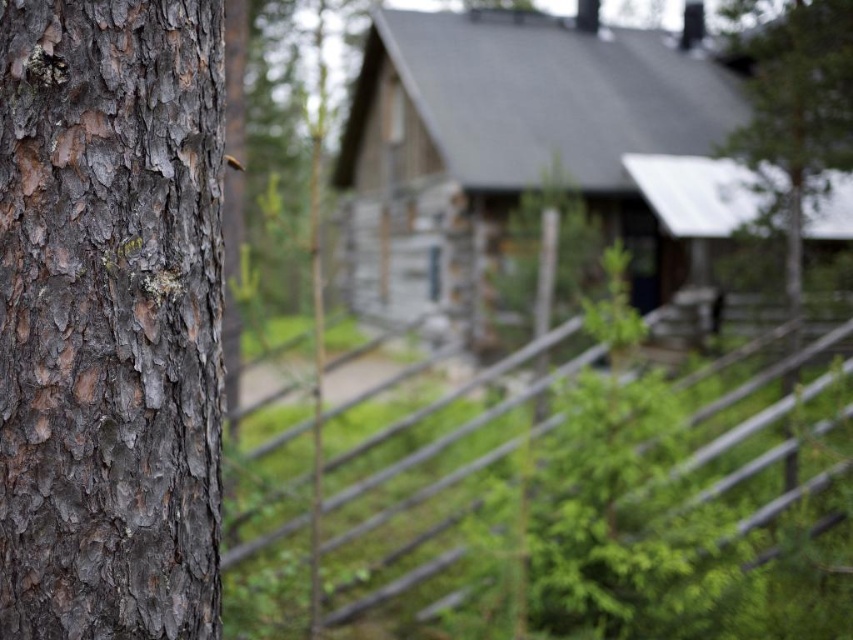
Question: Is wooden cabin at center to the right of wooden at center from the viewer's perspective?

Choices:
 (A) yes
 (B) no

Answer: (B)

Question: Where is wooden cabin at center located in relation to wooden at center in the image?

Choices:
 (A) below
 (B) above

Answer: (B)

Question: Does wooden cabin at center appear on the right side of green rough bark tree at upper right?

Choices:
 (A) no
 (B) yes

Answer: (A)

Question: Which point is closer to the camera?

Choices:
 (A) (334, 547)
 (B) (440, 282)
 (C) (844, 92)

Answer: (A)

Question: Which point is closer to the camera taking this photo?

Choices:
 (A) (709, 413)
 (B) (105, 200)
 (C) (415, 70)

Answer: (B)

Question: Which object is farther from the camera taking this photo?

Choices:
 (A) dark brown bark at left
 (B) wooden cabin at center
 (C) green rough bark tree at upper right

Answer: (B)